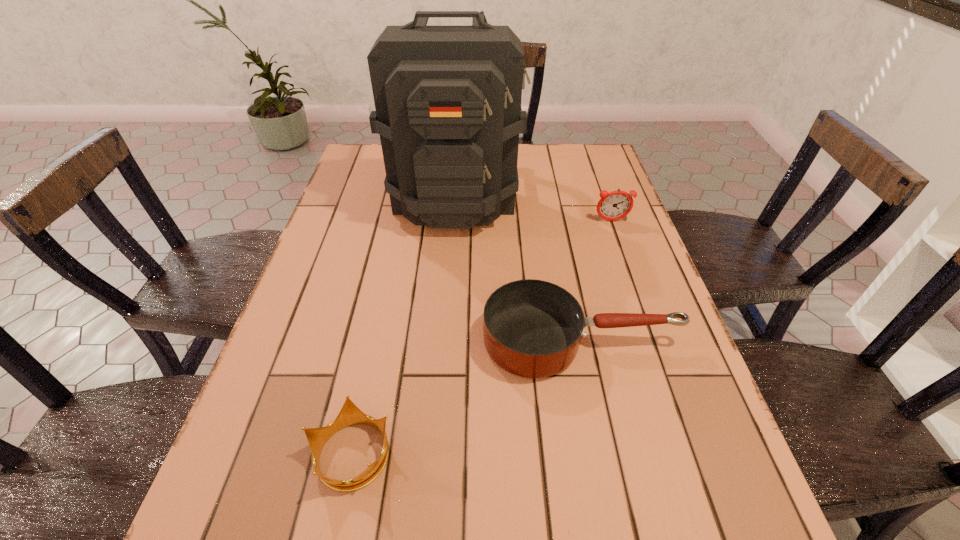
At what (x,y) coordinates should I click in order to perform the action: click on empty space that is in between the pan and the nearest object. Please return your answer as a coordinate pair (x, y). The image size is (960, 540). Looking at the image, I should click on (467, 397).

Locate an element on the screen. This screenshot has height=540, width=960. free space between the backpack and the pan is located at coordinates (518, 269).

Find the location of a particular element. vacant space in between the tallest object and the second tallest object is located at coordinates (534, 209).

The image size is (960, 540). What are the coordinates of `free space between the tallest object and the nearest object` in the screenshot? It's located at (403, 325).

Identify the location of free spot between the backpack and the alarm clock. (534, 209).

Locate an element on the screen. unoccupied position between the second tallest object and the nearest object is located at coordinates (482, 337).

Where is `empty space between the second tallest object and the crown`? This screenshot has width=960, height=540. empty space between the second tallest object and the crown is located at coordinates (482, 337).

You are a GUI agent. You are given a task and a screenshot of the screen. Output one action in this format:
    pyautogui.click(x=<x>, y=<y>)
    Task: Click on the free space between the alarm clock and the pan
    Image resolution: width=960 pixels, height=540 pixels.
    Given the screenshot: What is the action you would take?
    click(596, 281)

You are a GUI agent. You are given a task and a screenshot of the screen. Output one action in this format:
    pyautogui.click(x=<x>, y=<y>)
    Task: Click on the object that is the nearest to the pan
    
    Given the screenshot: What is the action you would take?
    pyautogui.click(x=350, y=414)

Identify the location of object that stands as the closest to the nearest object. This screenshot has height=540, width=960. (532, 328).